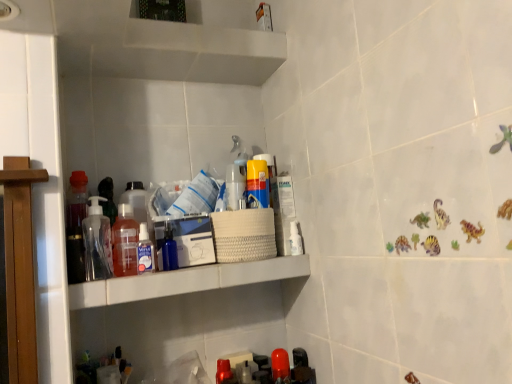
Question: Is white plastic shelf at upper center closer to camera compared to transparent plastic spray bottle at upper center, acting as the 3th toiletry starting from the right?

Choices:
 (A) no
 (B) yes

Answer: (B)

Question: Is white plastic shelf at upper center thinner than transparent plastic spray bottle at upper center, the 1th toiletry when ordered from left to right?

Choices:
 (A) yes
 (B) no

Answer: (B)

Question: Is white plastic shelf at upper center aimed at transparent plastic spray bottle at upper center, positioned as the 3th toiletry in back-to-front order?

Choices:
 (A) yes
 (B) no

Answer: (B)

Question: Can you confirm if white plastic shelf at upper center is shorter than transparent plastic spray bottle at upper center, the 1th toiletry positioned from the front?

Choices:
 (A) no
 (B) yes

Answer: (B)

Question: Are white plastic shelf at upper center and transparent plastic spray bottle at upper center, the 1th toiletry positioned from the front, located far from each other?

Choices:
 (A) yes
 (B) no

Answer: (B)

Question: From the image's perspective, is translucent plastic bottle at center, the second bottle positioned from the right, positioned above or below transparent plastic spray bottle at upper center, acting as the 3th toiletry starting from the right?

Choices:
 (A) below
 (B) above

Answer: (B)

Question: Is translucent plastic bottle at center, which is the third bottle from left to right, inside or outside of transparent plastic spray bottle at upper center, the 1th toiletry positioned from the front?

Choices:
 (A) outside
 (B) inside

Answer: (A)

Question: Is point (112, 233) closer or farther from the camera than point (150, 264)?

Choices:
 (A) farther
 (B) closer

Answer: (A)

Question: In the image, is translucent plastic bottle at center, the second bottle positioned from the right, positioned in front of or behind transparent plastic spray bottle at upper center, the 1th toiletry when ordered from left to right?

Choices:
 (A) front
 (B) behind

Answer: (A)

Question: Would you say transparent plastic spray bottle at upper center, acting as the 3th toiletry starting from the right, is to the left or to the right of matte plastic can at center, which is counted as the 2th toiletry, starting from the back, in the picture?

Choices:
 (A) right
 (B) left

Answer: (B)

Question: Is transparent plastic spray bottle at upper center, the 1th toiletry when ordered from left to right, bigger or smaller than matte plastic can at center, which is counted as the 2th toiletry, starting from the back?

Choices:
 (A) small
 (B) big

Answer: (A)

Question: Considering their positions, is transparent plastic spray bottle at upper center, positioned as the 3th toiletry in back-to-front order, located in front of or behind matte plastic can at center, the second toiletry from the left?

Choices:
 (A) front
 (B) behind

Answer: (A)

Question: Considering the positions of transparent plastic spray bottle at upper center, acting as the 3th toiletry starting from the right, and matte plastic can at center, the second toiletry when ordered from right to left, in the image, is transparent plastic spray bottle at upper center, acting as the 3th toiletry starting from the right, wider or thinner than matte plastic can at center, the second toiletry when ordered from right to left,?

Choices:
 (A) thin
 (B) wide

Answer: (A)

Question: From a real-world perspective, is white plastic shelf at upper center positioned above or below translucent plastic pump bottle at left, the 3th bottle when ordered from right to left?

Choices:
 (A) above
 (B) below

Answer: (B)

Question: In the image, is white plastic shelf at upper center positioned in front of or behind translucent plastic pump bottle at left, the 2th bottle viewed from the left?

Choices:
 (A) front
 (B) behind

Answer: (A)